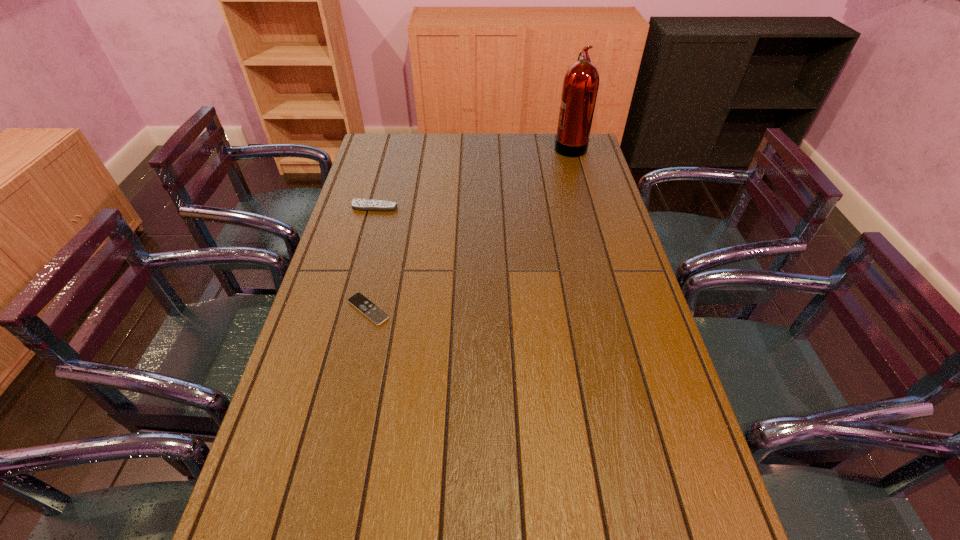
Locate an element on the screen. This screenshot has width=960, height=540. free space between the second nearest object and the nearer remote control is located at coordinates (372, 258).

Where is `vacant area that lies between the rightmost object and the farther remote control`? vacant area that lies between the rightmost object and the farther remote control is located at coordinates (472, 176).

Locate an element on the screen. vacant space that is in between the tallest object and the second farthest object is located at coordinates (472, 176).

Where is `vacant point located between the taller remote control and the shortest object`? vacant point located between the taller remote control and the shortest object is located at coordinates (372, 258).

Image resolution: width=960 pixels, height=540 pixels. I want to click on vacant area that lies between the rightmost object and the nearer remote control, so click(469, 227).

Where is `vacant area between the fire extinguisher and the taller remote control`? vacant area between the fire extinguisher and the taller remote control is located at coordinates (472, 176).

Locate an element on the screen. free space between the nearest object and the rightmost object is located at coordinates (469, 227).

At what (x,y) coordinates should I click in order to perform the action: click on empty location between the shortest object and the fire extinguisher. Please return your answer as a coordinate pair (x, y). The width and height of the screenshot is (960, 540). Looking at the image, I should click on (469, 227).

Where is `object that is the second closest one to the farther remote control`? object that is the second closest one to the farther remote control is located at coordinates pos(580,87).

Identify the location of object that is the second closest one to the tallest object. The image size is (960, 540). (370, 310).